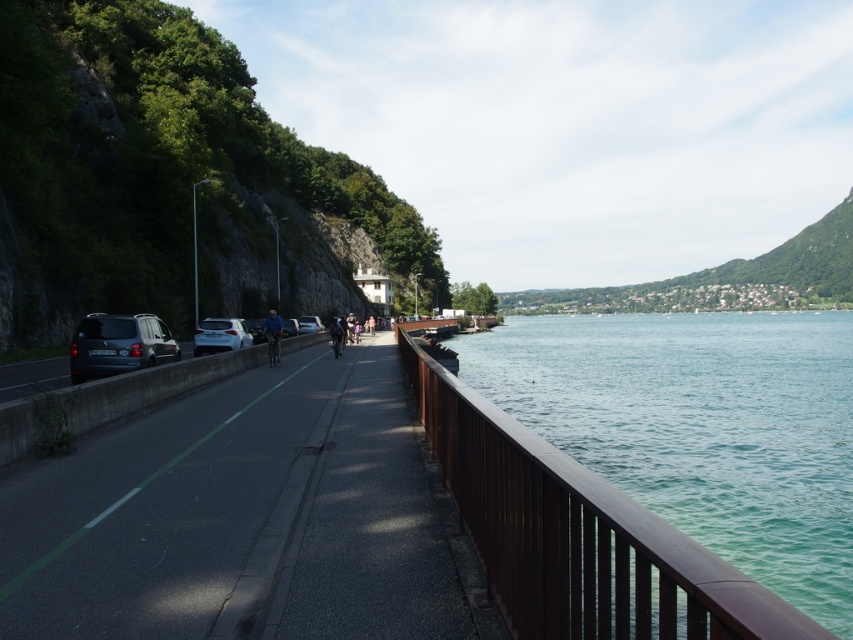
You are a photographer standing on the riverside pathway. You want to take a photo that includes both the green water at right and the matte black van at left. Which object will appear larger in your photo?

The green water at right will appear larger in the photo because it has a greater height compared to the matte black van at left.

Consider the image. You are standing at the point with coordinates point (338,332) and want to move towards the point with coordinates point (306,332). Given that the path is 1 meter wide, can you walk directly towards the second point without crossing the path or the road?

Point (338,332) is closer to the viewer than point (306,332). Since the path is 1 meter wide, you can walk directly towards the second point without crossing the path or the road as long as you stay within the path boundaries.

You are a cyclist planning to ride from the green line center pathway towards the blue fabric jacket at center. There is a matte black van at left parked on the road. Considering the space they occupy, which object would you need to maneuver around first?

The matte black van at left occupies less space than the blue fabric jacket at center, so you would need to maneuver around the blue fabric jacket at center first since it takes up more space on the pathway.